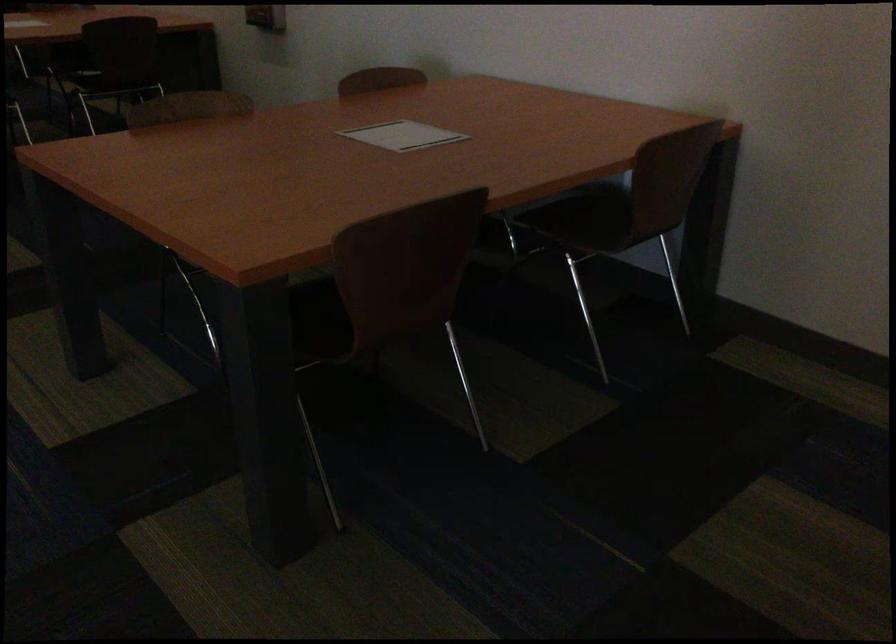
Based on the continuous images, in which direction is the camera rotating?

The rotation direction of the camera is left-down.